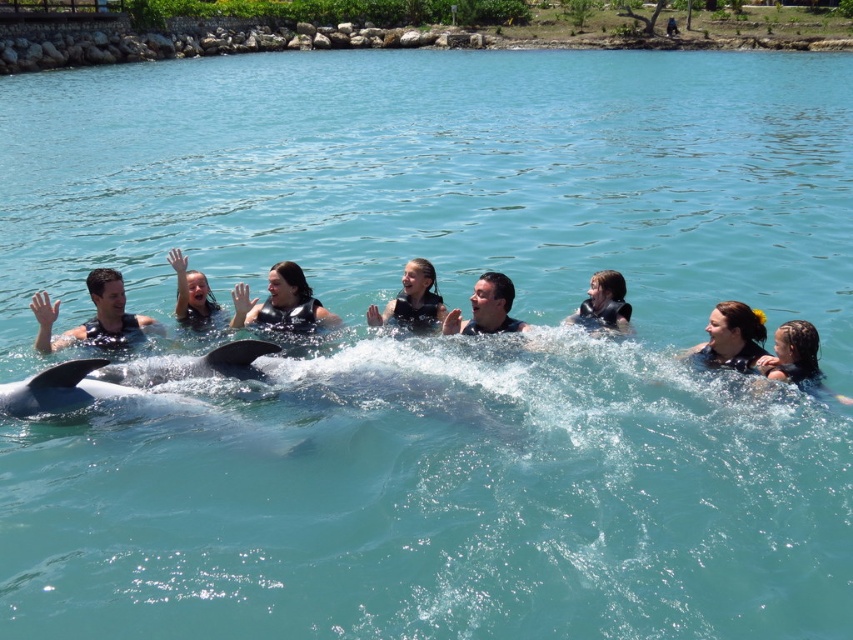
You are a dolphin trainer guiding a group of swimmers. You notice two points in the water where the dolphins are swimming. The first point is at coordinates point (99, 324) and the second is at point (305, 292). From the swimmers perspective, which point is closer to them?

Point (99, 324) is in front of point (305, 292), so it is closer to the swimmers.

You are a lifeguard on duty and need to ensure that the black matte life vest at center can accommodate the smooth skin man at center. Based on the scene description, can the life vest fit the man?

The black matte life vest at center is wider than the smooth skin man at center, so it should be able to accommodate him comfortably.

You are a photographer trying to capture a photo of the gray smooth whale at lower left and the smooth skin girl at center. From your current position, which subject is positioned lower in the frame?

The gray smooth whale at lower left is located below the smooth skin girl at center, so it is positioned lower in the frame.